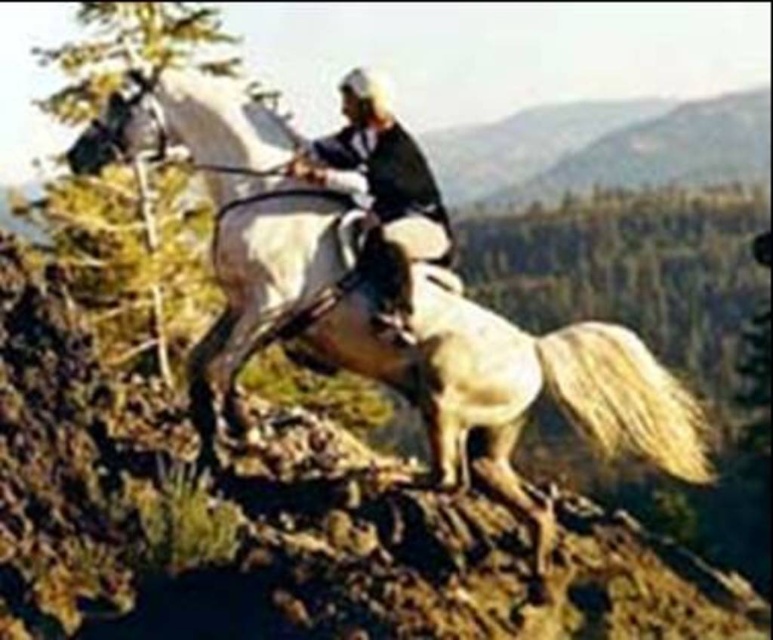
Does white glossy horse at center have a smaller size compared to smooth leather jacket at center?

Incorrect, white glossy horse at center is not smaller in size than smooth leather jacket at center.

Can you confirm if white glossy horse at center is bigger than smooth leather jacket at center?

Yes.

At what (x,y) coordinates should I click in order to perform the action: click on white glossy horse at center. Please return your answer as a coordinate pair (x, y). The height and width of the screenshot is (640, 773). Looking at the image, I should click on (397, 316).